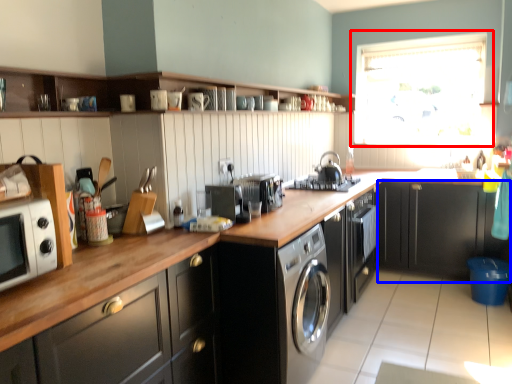
Question: Among these objects, which one is nearest to the camera, window (highlighted by a red box) or cabinetry (highlighted by a blue box)?

Choices:
 (A) window
 (B) cabinetry

Answer: (B)